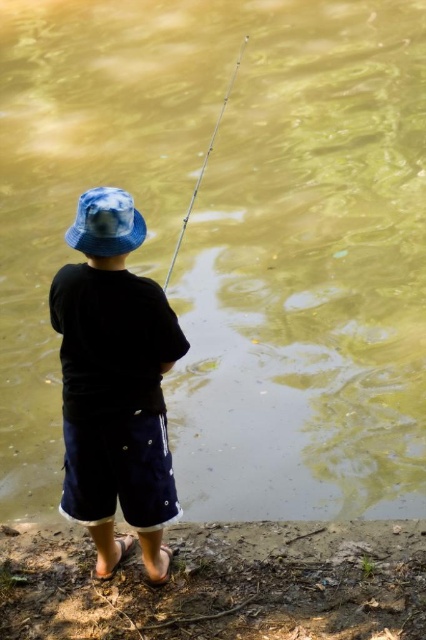
You are a photographer trying to capture the child in the scene. You notice the blue fabric bucket hat at center and the silver metallic fishing pole at center. Which object is narrower in width?

The blue fabric bucket hat at center has a lesser width compared to the silver metallic fishing pole at center, so the blue fabric bucket hat at center is narrower.